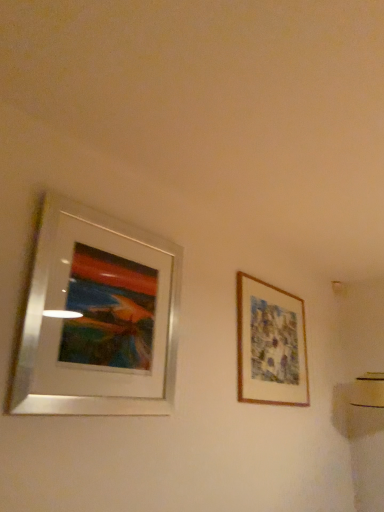
Question: Should I look upward or downward to see wooden framed artwork at right, marked as the second picture frame in a front-to-back arrangement?

Choices:
 (A) up
 (B) down

Answer: (B)

Question: From a real-world perspective, is silver metallic picture frame at left, acting as the second picture frame starting from the back, positioned under wooden framed artwork at right, which appears as the first picture frame when viewed from the right, based on gravity?

Choices:
 (A) no
 (B) yes

Answer: (B)

Question: From a real-world perspective, is silver metallic picture frame at left, placed as the 1th picture frame when sorted from left to right, on top of wooden framed artwork at right, arranged as the second picture frame when viewed from the left?

Choices:
 (A) no
 (B) yes

Answer: (A)

Question: Is silver metallic picture frame at left, which is the first picture frame in front-to-back order, taller than wooden framed artwork at right, which appears as the first picture frame when viewed from the right?

Choices:
 (A) yes
 (B) no

Answer: (A)

Question: Can you confirm if silver metallic picture frame at left, positioned as the second picture frame in right-to-left order, is thinner than wooden framed artwork at right, acting as the 1th picture frame starting from the back?

Choices:
 (A) no
 (B) yes

Answer: (A)

Question: Does silver metallic picture frame at left, acting as the second picture frame starting from the back, have a greater width compared to wooden framed artwork at right, which appears as the first picture frame when viewed from the right?

Choices:
 (A) yes
 (B) no

Answer: (A)

Question: From the image's perspective, is silver metallic picture frame at left, positioned as the second picture frame in right-to-left order, above wooden framed artwork at right, marked as the second picture frame in a front-to-back arrangement?

Choices:
 (A) yes
 (B) no

Answer: (A)

Question: Is wooden framed artwork at right, arranged as the second picture frame when viewed from the left, outside silver metallic picture frame at left, positioned as the second picture frame in right-to-left order?

Choices:
 (A) no
 (B) yes

Answer: (B)

Question: Is wooden framed artwork at right, marked as the second picture frame in a front-to-back arrangement, wider than silver metallic picture frame at left, positioned as the second picture frame in right-to-left order?

Choices:
 (A) no
 (B) yes

Answer: (A)

Question: Considering the relative sizes of wooden framed artwork at right, marked as the second picture frame in a front-to-back arrangement, and silver metallic picture frame at left, which is the first picture frame in front-to-back order, in the image provided, is wooden framed artwork at right, marked as the second picture frame in a front-to-back arrangement, thinner than silver metallic picture frame at left, which is the first picture frame in front-to-back order,?

Choices:
 (A) no
 (B) yes

Answer: (B)

Question: From the image's perspective, is wooden framed artwork at right, marked as the second picture frame in a front-to-back arrangement, located above silver metallic picture frame at left, which is the first picture frame in front-to-back order?

Choices:
 (A) yes
 (B) no

Answer: (B)

Question: Is the depth of wooden framed artwork at right, acting as the 1th picture frame starting from the back, less than that of silver metallic picture frame at left, placed as the 1th picture frame when sorted from left to right?

Choices:
 (A) yes
 (B) no

Answer: (B)

Question: Is wooden framed artwork at right, which appears as the first picture frame when viewed from the right, shorter than silver metallic picture frame at left, positioned as the second picture frame in right-to-left order?

Choices:
 (A) no
 (B) yes

Answer: (B)

Question: Choose the correct answer: Is wooden framed artwork at right, marked as the second picture frame in a front-to-back arrangement, inside silver metallic picture frame at left, positioned as the second picture frame in right-to-left order, or outside it?

Choices:
 (A) outside
 (B) inside

Answer: (A)